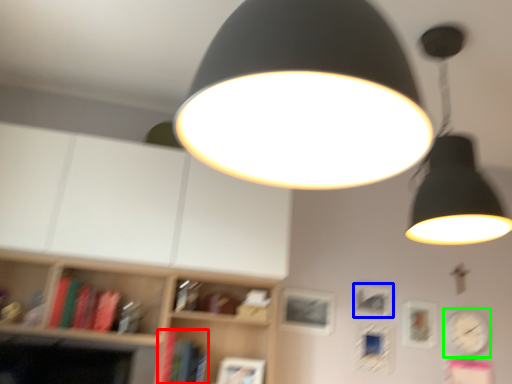
Question: Which object is the farthest from book (highlighted by a red box)? Choose among these: picture frame (highlighted by a blue box) or clock (highlighted by a green box).

Choices:
 (A) picture frame
 (B) clock

Answer: (B)